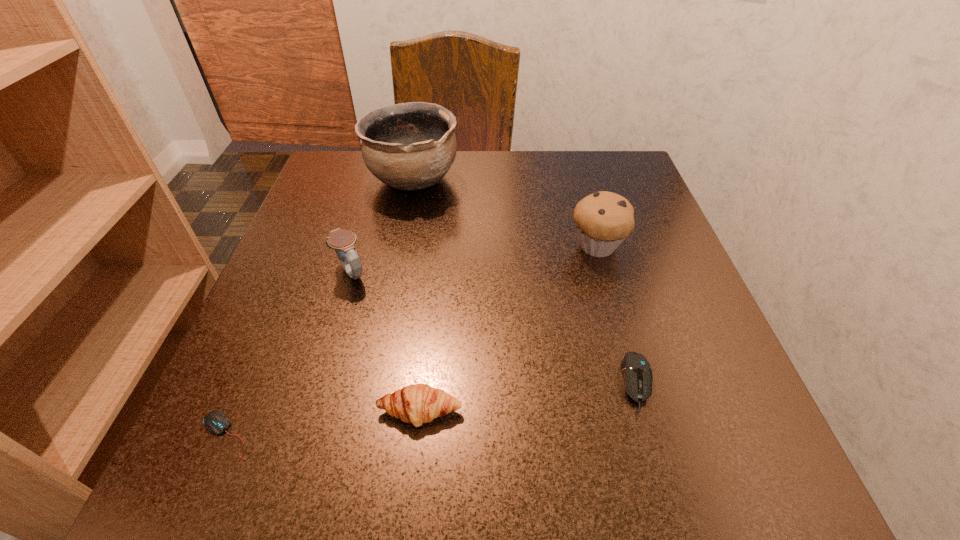
At what (x,y) coordinates should I click in order to perform the action: click on mouse present at the left edge. Please return your answer as a coordinate pair (x, y). Looking at the image, I should click on (216, 422).

This screenshot has width=960, height=540. I want to click on muffin at the right edge, so click(603, 219).

This screenshot has height=540, width=960. I want to click on computer mouse that is at the right edge, so click(x=636, y=370).

The width and height of the screenshot is (960, 540). Identify the location of object that is at the far left corner. (x=411, y=146).

Identify the location of object that is at the near left corner. (216, 422).

At what (x,y) coordinates should I click in order to perform the action: click on free space at the far edge of the desktop. Please return your answer as a coordinate pair (x, y). Looking at the image, I should click on (395, 194).

In the image, there is a desktop. At what (x,y) coordinates should I click in order to perform the action: click on blank space at the left edge. Please return your answer as a coordinate pair (x, y). This screenshot has width=960, height=540. Looking at the image, I should click on (275, 285).

In the image, there is a desktop. Identify the location of free space at the right edge. (655, 220).

Locate an element on the screen. The width and height of the screenshot is (960, 540). free region at the far left corner of the desktop is located at coordinates (348, 160).

Where is `free space at the far right corner of the desktop`? free space at the far right corner of the desktop is located at coordinates coord(577,151).